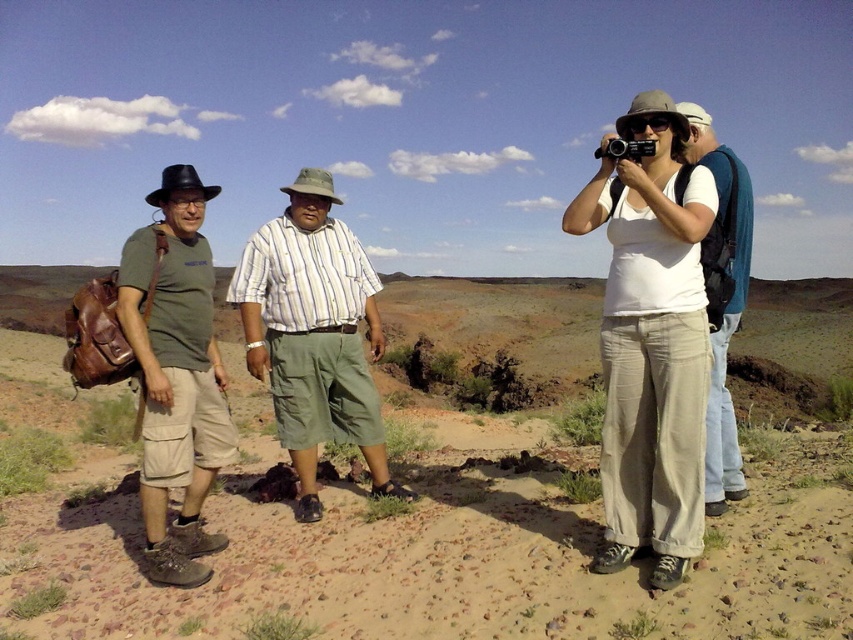
Does brown dirt field at center have a lesser width compared to white cotton tank top at center?

Incorrect, brown dirt field at center's width is not less than white cotton tank top at center's.

Between brown dirt field at center and white cotton tank top at center, which one appears on the left side from the viewer's perspective?

Positioned to the left is brown dirt field at center.

The width and height of the screenshot is (853, 640). What are the coordinates of `brown dirt field at center` in the screenshot? It's located at (433, 490).

Between brown dirt field at center and white cotton shirt at center, which one has less height?

white cotton shirt at center is shorter.

Does brown dirt field at center have a lesser width compared to white cotton shirt at center?

No.

Describe the element at coordinates (433, 490) in the screenshot. I see `brown dirt field at center` at that location.

You are a GUI agent. You are given a task and a screenshot of the screen. Output one action in this format:
    pyautogui.click(x=<x>, y=<y>)
    Task: Click on the brown dirt field at center
    This screenshot has width=853, height=640.
    Given the screenshot: What is the action you would take?
    pyautogui.click(x=433, y=490)

Who is positioned more to the right, striped cotton shirt at center or green matte t-shirt at left?

Positioned to the right is striped cotton shirt at center.

Describe the element at coordinates (312, 333) in the screenshot. The height and width of the screenshot is (640, 853). I see `striped cotton shirt at center` at that location.

Which is behind, point (300, 428) or point (173, 435)?

Positioned behind is point (300, 428).

Find the location of `striped cotton shirt at center`. striped cotton shirt at center is located at coordinates (312, 333).